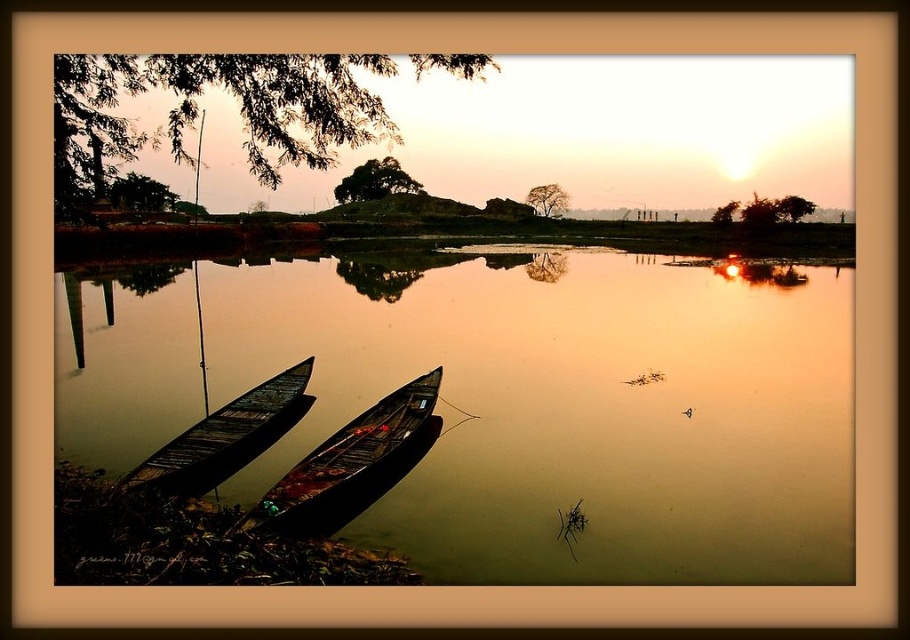
Based on the photo, is brown wooden river at center to the right of dark wood canoe at lower left from the viewer's perspective?

In fact, brown wooden river at center is to the left of dark wood canoe at lower left.

Is point (835, 392) farther from camera compared to point (218, 467)?

That is True.

Which is behind, point (714, 474) or point (235, 433)?

The point (235, 433) is behind.

Image resolution: width=910 pixels, height=640 pixels. In order to click on brown wooden river at center in this screenshot , I will do `click(511, 400)`.

Between brown wooden river at center and wooden canoe at center, which one has less height?

wooden canoe at center is shorter.

Can you confirm if brown wooden river at center is thinner than wooden canoe at center?

Incorrect, brown wooden river at center's width is not less than wooden canoe at center's.

Is point (747, 556) more distant than point (265, 528)?

That is True.

Find the location of a particular element. The image size is (910, 640). brown wooden river at center is located at coordinates (511, 400).

Is wooden canoe at center positioned at the back of dark wood canoe at lower left?

No, it is not.

Is wooden canoe at center bigger than dark wood canoe at lower left?

Correct, wooden canoe at center is larger in size than dark wood canoe at lower left.

Between point (383, 406) and point (238, 458), which one is positioned in front?

Positioned in front is point (238, 458).

Locate an element on the screen. wooden canoe at center is located at coordinates (351, 465).